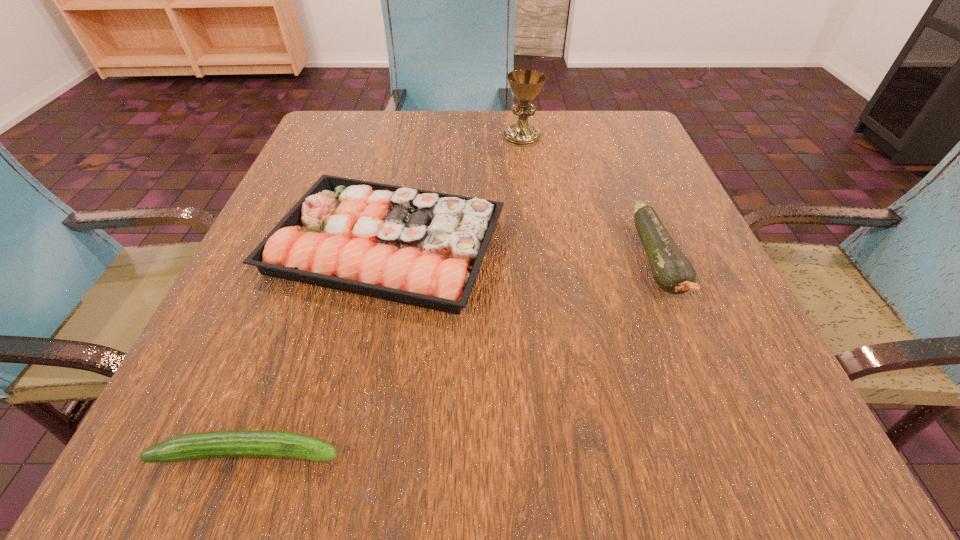
Where is `free space located 0.230m on the front-facing side of the nearer zucchini`? free space located 0.230m on the front-facing side of the nearer zucchini is located at coordinates (546, 452).

Where is `object that is positioned at the far edge`? This screenshot has height=540, width=960. object that is positioned at the far edge is located at coordinates (525, 85).

The image size is (960, 540). Identify the location of object that is positioned at the near edge. (233, 443).

The image size is (960, 540). Find the location of `platter that is at the left edge`. platter that is at the left edge is located at coordinates (410, 246).

Image resolution: width=960 pixels, height=540 pixels. What are the coordinates of `zucchini positioned at the left edge` in the screenshot? It's located at (233, 443).

You are a GUI agent. You are given a task and a screenshot of the screen. Output one action in this format:
    pyautogui.click(x=<x>, y=<y>)
    Task: Click on the object located at the right edge
    
    Given the screenshot: What is the action you would take?
    [x=673, y=272]

Where is `object that is at the near left corner`? Image resolution: width=960 pixels, height=540 pixels. object that is at the near left corner is located at coordinates (233, 443).

In the image, there is a desktop. In order to click on vacant space at the far edge in this screenshot , I will do `click(450, 134)`.

In the image, there is a desktop. Find the location of `vacant space at the left edge`. vacant space at the left edge is located at coordinates [x=340, y=176].

Identify the location of vacant space at the right edge of the desktop. (719, 314).